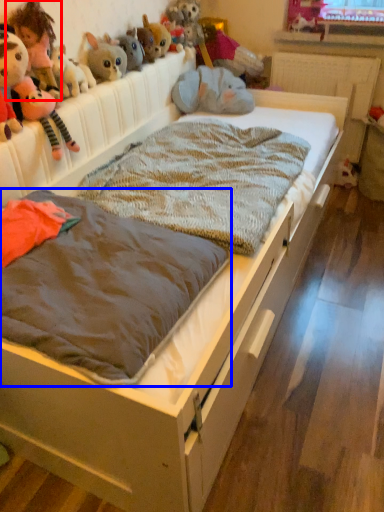
Question: Which point is further to the camera, toy (highlighted by a red box) or mattress (highlighted by a blue box)?

Choices:
 (A) toy
 (B) mattress

Answer: (A)